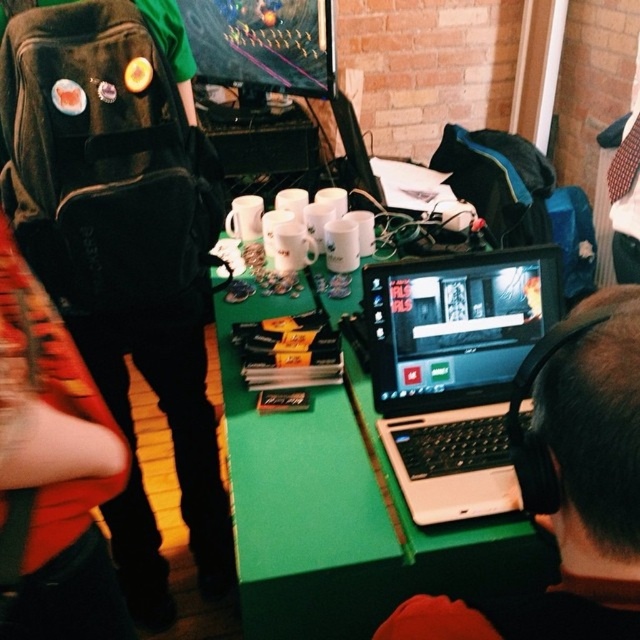
Which of these two, green matte table at center or white plastic laptop at center, stands taller?

green matte table at center is taller.

Between point (394, 593) and point (426, 465), which one is positioned behind?

Point (426, 465)

The width and height of the screenshot is (640, 640). I want to click on green matte table at center, so click(x=342, y=513).

Who is positioned more to the right, green matte table at center or black matte laptop at lower right?

black matte laptop at lower right

Does green matte table at center have a larger size compared to black matte laptop at lower right?

Indeed, green matte table at center has a larger size compared to black matte laptop at lower right.

Is point (365, 563) closer to viewer compared to point (557, 508)?

No, it is not.

The width and height of the screenshot is (640, 640). Identify the location of green matte table at center. (342, 513).

Who is shorter, black matte laptop at lower right or white plastic laptop at center?

black matte laptop at lower right is shorter.

Is black matte laptop at lower right bigger than white plastic laptop at center?

No.

Is point (406, 602) positioned after point (451, 444)?

That is False.

The image size is (640, 640). I want to click on black matte laptop at lower right, so click(x=568, y=484).